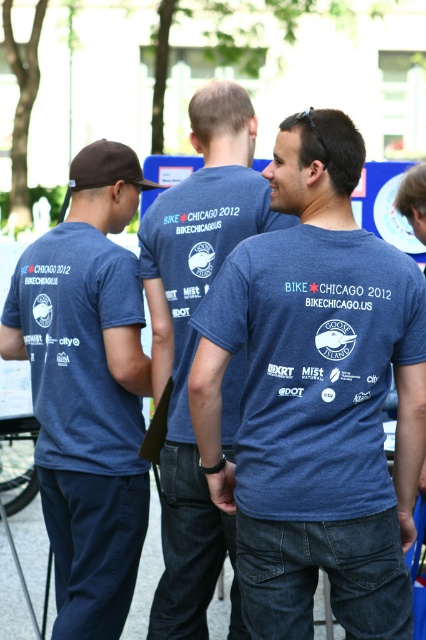
Question: Is the position of matte blue t-shirt at center more distant than that of blue cotton t-shirt at center?

Choices:
 (A) yes
 (B) no

Answer: (B)

Question: Is matte blue t-shirt at left below blue cotton t-shirt at center?

Choices:
 (A) yes
 (B) no

Answer: (A)

Question: Which point is farther to the camera?

Choices:
 (A) (37, 387)
 (B) (255, 310)
 (C) (215, 177)

Answer: (A)

Question: Based on their relative distances, which object is nearer to the matte blue t-shirt at left?

Choices:
 (A) blue cotton t-shirt at center
 (B) matte blue t-shirt at center

Answer: (A)

Question: Where is matte blue t-shirt at center located in relation to matte blue t-shirt at left in the image?

Choices:
 (A) above
 (B) below

Answer: (A)

Question: Estimate the real-world distances between objects in this image. Which object is closer to the blue cotton t-shirt at center?

Choices:
 (A) matte blue t-shirt at center
 (B) matte blue t-shirt at left

Answer: (B)